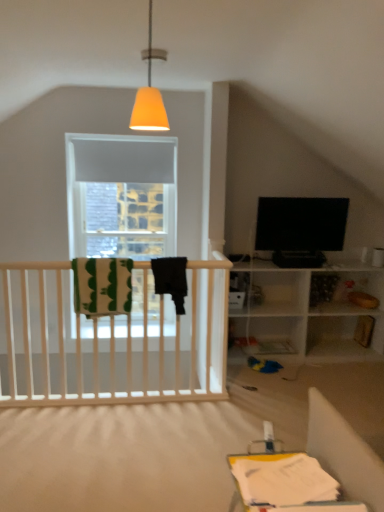
Question: From a real-world perspective, does green striped blanket at left sit lower than matte orange cone at upper center?

Choices:
 (A) yes
 (B) no

Answer: (A)

Question: Is green striped blanket at left bigger than matte orange cone at upper center?

Choices:
 (A) yes
 (B) no

Answer: (A)

Question: Is matte orange cone at upper center located within green striped blanket at left?

Choices:
 (A) yes
 (B) no

Answer: (B)

Question: Is green striped blanket at left wider than matte orange cone at upper center?

Choices:
 (A) no
 (B) yes

Answer: (B)

Question: From the image's perspective, is green striped blanket at left on matte orange cone at upper center?

Choices:
 (A) yes
 (B) no

Answer: (B)

Question: Considering the positions of black glossy tv at upper right and matte orange cone at upper center in the image, is black glossy tv at upper right bigger or smaller than matte orange cone at upper center?

Choices:
 (A) big
 (B) small

Answer: (A)

Question: Is black glossy tv at upper right taller or shorter than matte orange cone at upper center?

Choices:
 (A) tall
 (B) short

Answer: (B)

Question: Is point (269, 231) closer or farther from the camera than point (135, 116)?

Choices:
 (A) farther
 (B) closer

Answer: (A)

Question: Based on their positions, is black glossy tv at upper right located to the left or right of matte orange cone at upper center?

Choices:
 (A) left
 (B) right

Answer: (B)

Question: Considering their positions, is green striped blanket at left located in front of or behind matte orange cone at upper center?

Choices:
 (A) front
 (B) behind

Answer: (B)

Question: Based on their sizes in the image, would you say green striped blanket at left is bigger or smaller than matte orange cone at upper center?

Choices:
 (A) small
 (B) big

Answer: (B)

Question: From their relative heights in the image, would you say green striped blanket at left is taller or shorter than matte orange cone at upper center?

Choices:
 (A) short
 (B) tall

Answer: (A)

Question: In terms of width, does green striped blanket at left look wider or thinner when compared to matte orange cone at upper center?

Choices:
 (A) wide
 (B) thin

Answer: (A)

Question: Considering the positions of point (134, 122) and point (86, 292), is point (134, 122) closer or farther from the camera than point (86, 292)?

Choices:
 (A) closer
 (B) farther

Answer: (A)

Question: From a real-world perspective, relative to green striped blanket at left, is matte orange cone at upper center vertically above or below?

Choices:
 (A) above
 (B) below

Answer: (A)